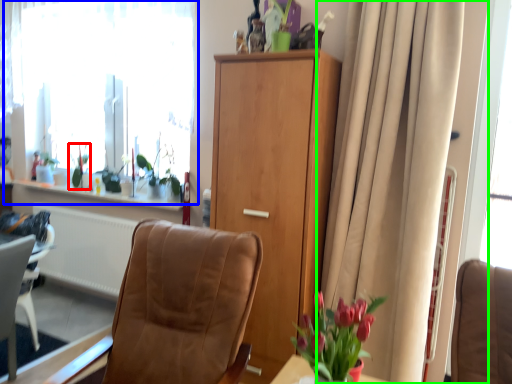
Question: Which object is the closest to the plant (highlighted by a red box)? Choose among these: window (highlighted by a blue box) or curtain (highlighted by a green box).

Choices:
 (A) window
 (B) curtain

Answer: (A)